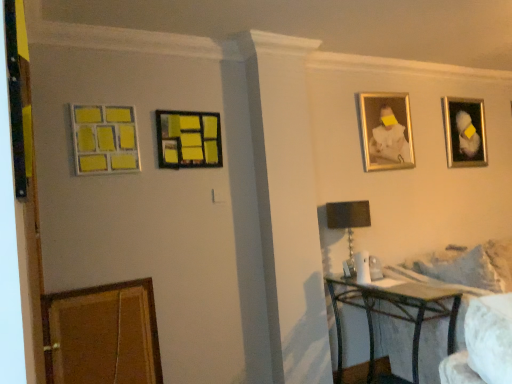
Question: Is metallic black table at lower right in front of or behind metallic silver picture frame at upper right, which is the 1th picture frame in back-to-front order, in the image?

Choices:
 (A) front
 (B) behind

Answer: (A)

Question: From a real-world perspective, is metallic black table at lower right positioned above or below metallic silver picture frame at upper right, the 1th picture frame positioned from the right?

Choices:
 (A) below
 (B) above

Answer: (A)

Question: Considering the real-world distances, which object is farthest from the white fluffy pillow at right?

Choices:
 (A) matte black table lamp at lower right
 (B) gold metallic picture frame at upper right, the 2th picture frame viewed from the right
 (C) metallic black table at lower right
 (D) matte plastic picture frame at center, which is the third picture frame from back to front
 (E) white fabric couch at lower right

Answer: (D)

Question: Which of these objects is positioned farthest from the metallic black table at lower right?

Choices:
 (A) white fluffy pillow at right
 (B) matte black table lamp at lower right
 (C) matte plastic picture frame at center, which is the 2th picture frame in left-to-right order
 (D) yellow matte picture frame at upper left, marked as the first picture frame in a front-to-back arrangement
 (E) white fabric couch at lower right

Answer: (D)